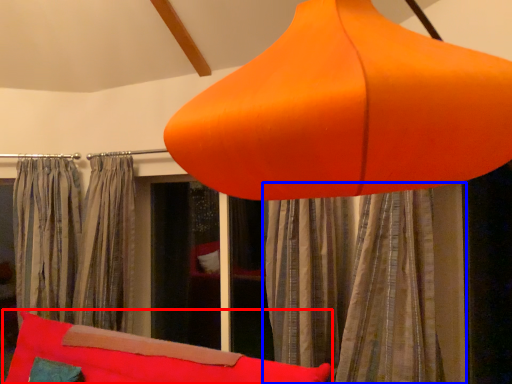
Question: Which object appears farthest to the camera in this image, bean bag chair (highlighted by a red box) or curtain (highlighted by a blue box)?

Choices:
 (A) bean bag chair
 (B) curtain

Answer: (B)